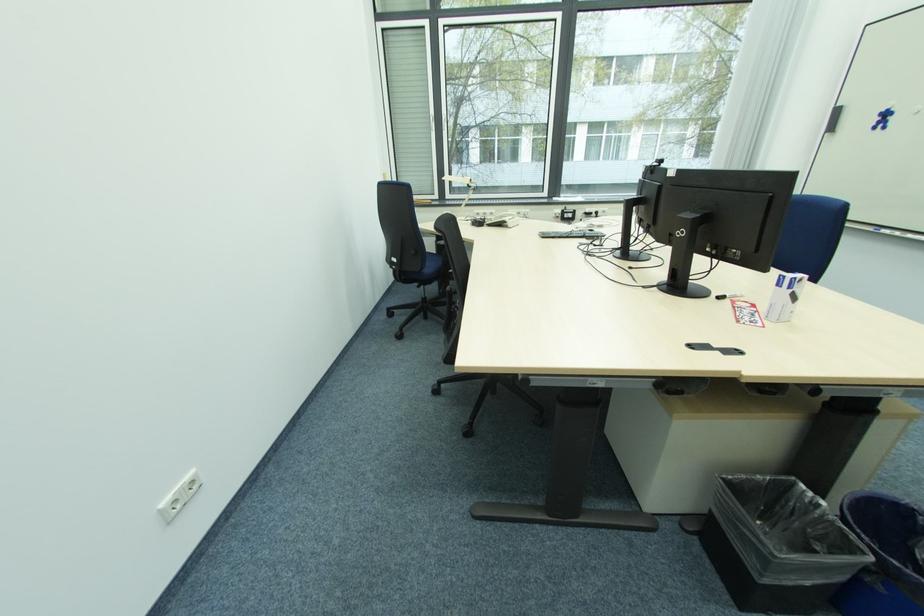
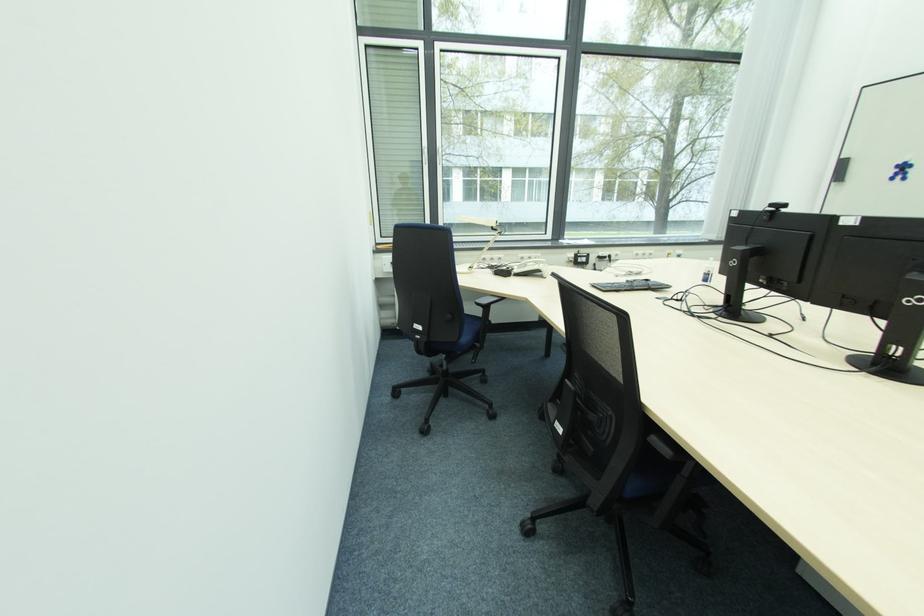
In the second image, find the point that corresponds to pixel 594 233 in the first image.

(650, 283)